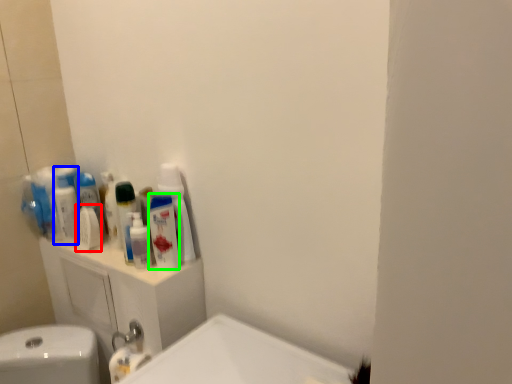
Question: Estimate the real-world distances between objects in this image. Which object is farther from mouthwash (highlighted by a red box), mouthwash (highlighted by a blue box) or mouthwash (highlighted by a green box)?

Choices:
 (A) mouthwash
 (B) mouthwash

Answer: (B)